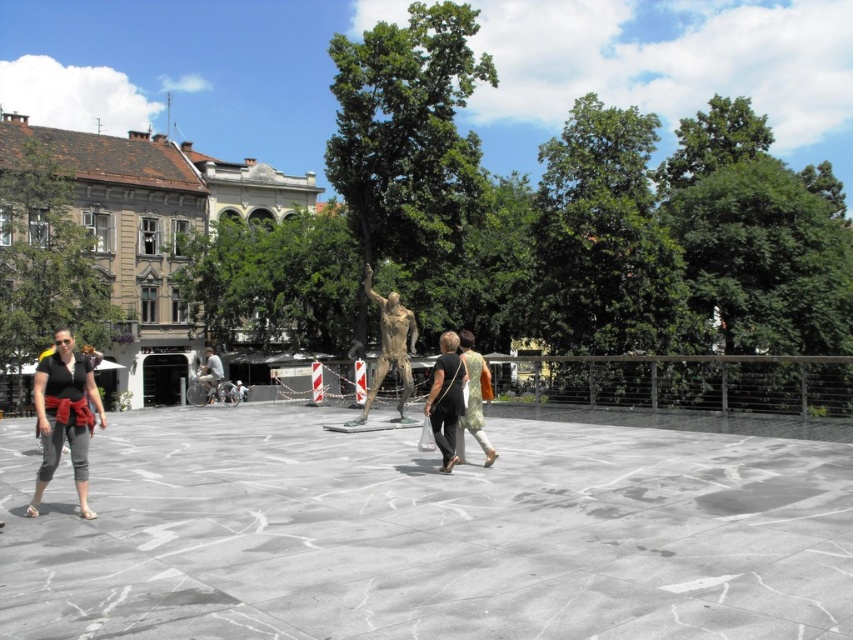
Question: Can you confirm if bronze statue at center is smaller than light brown leather jacket at center?

Choices:
 (A) yes
 (B) no

Answer: (B)

Question: Among these objects, which one is farthest from the camera?

Choices:
 (A) green textured dress at center
 (B) bronze statue at center
 (C) gray polished stone at center

Answer: (B)

Question: Does black fabric bag at center have a lesser width compared to green textured dress at center?

Choices:
 (A) no
 (B) yes

Answer: (A)

Question: Which point is farther to the camera?

Choices:
 (A) (480, 426)
 (B) (77, 476)
 (C) (445, 445)
 (D) (368, 392)

Answer: (D)

Question: Is bronze statue at center bigger than green textured dress at center?

Choices:
 (A) yes
 (B) no

Answer: (A)

Question: Which point appears closest to the camera in this image?

Choices:
 (A) (553, 568)
 (B) (212, 400)

Answer: (A)